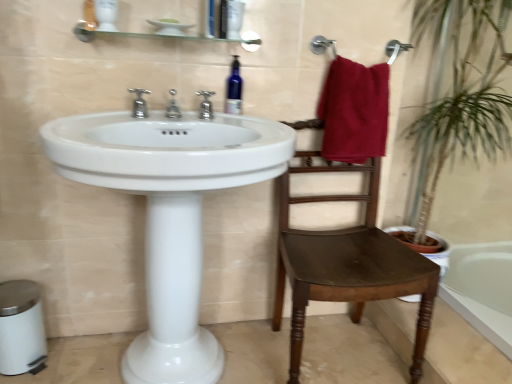
What are the coordinates of `free space to the back side of silver metallic faucet at upper center, the 2th tap positioned from the right` in the screenshot? It's located at (187, 120).